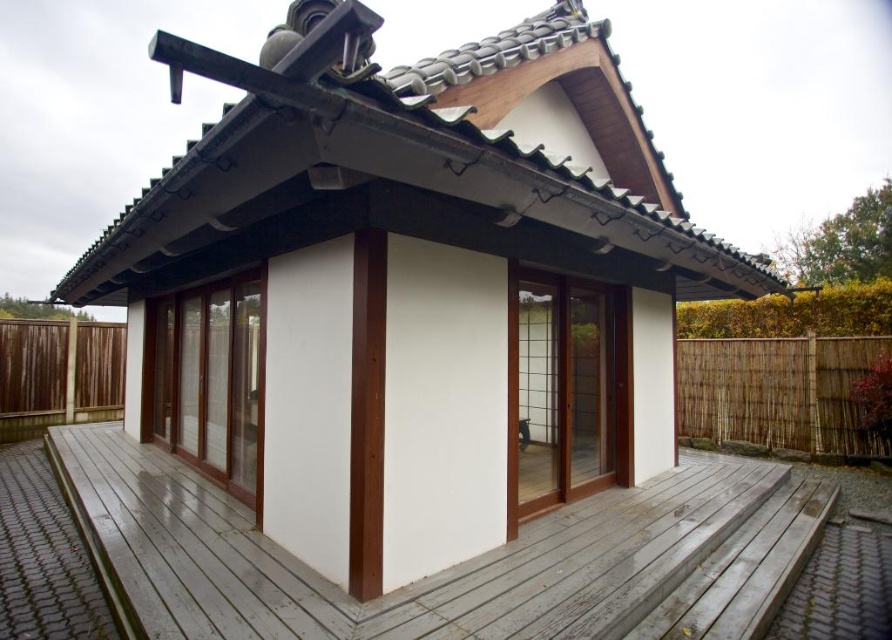
You are standing in front of the traditional house and notice the shiny black tiles at upper center. Can you determine their exact position relative to the center of the house?

The shiny black tiles at upper center are positioned at coordinates point (411, 163), which places them slightly to the left and above the center of the house.

You are planning to install a new decorative element on the shiny black tiles at upper center and the smooth wooden deck at center. If the decorative element requires a surface width of at least 1 meter, which object can accommodate it based on their widths?

The shiny black tiles at upper center might be wider than the smooth wooden deck at center, so the shiny black tiles at upper center is more likely to accommodate the decorative element requiring a surface width of at least 1 meter.

You are standing in front of the traditional house and notice two points marked on its roof. The first point is located at coordinates point (127, 214), and the second at point (340, 600). Which of these two points is closer to your viewpoint?

Point (127, 214) is further to the camera than point (340, 600), so the point closer to your viewpoint is point (340, 600).